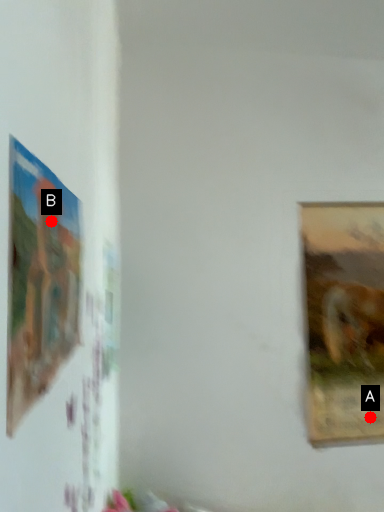
Question: Two points are circled on the image, labeled by A and B beside each circle. Which point appears closest to the camera in this image?

Choices:
 (A) A is closer
 (B) B is closer

Answer: (B)